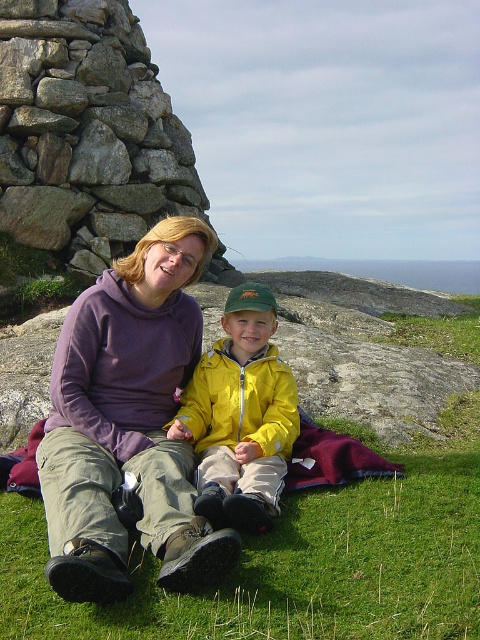
Consider the image. Measure the distance between purple fleece at center and yellow matte jacket at center.

The distance of purple fleece at center from yellow matte jacket at center is 21.60 inches.

Is purple fleece at center to the right of yellow matte jacket at center from the viewer's perspective?

In fact, purple fleece at center is to the left of yellow matte jacket at center.

The height and width of the screenshot is (640, 480). I want to click on purple fleece at center, so click(128, 422).

Can you confirm if green grass at lower center is smaller than purple fleece at center?

Indeed, green grass at lower center has a smaller size compared to purple fleece at center.

What do you see at coordinates (300, 560) in the screenshot? I see `green grass at lower center` at bounding box center [300, 560].

I want to click on green grass at lower center, so click(300, 560).

Can you confirm if rustic stone cairn at left is positioned below yellow matte jacket at center?

Actually, rustic stone cairn at left is above yellow matte jacket at center.

Is rustic stone cairn at left above yellow matte jacket at center?

Indeed, rustic stone cairn at left is positioned over yellow matte jacket at center.

Between point (12, 60) and point (228, 346), which one is positioned behind?

Positioned behind is point (12, 60).

The height and width of the screenshot is (640, 480). Find the location of `rustic stone cairn at left`. rustic stone cairn at left is located at coordinates (86, 131).